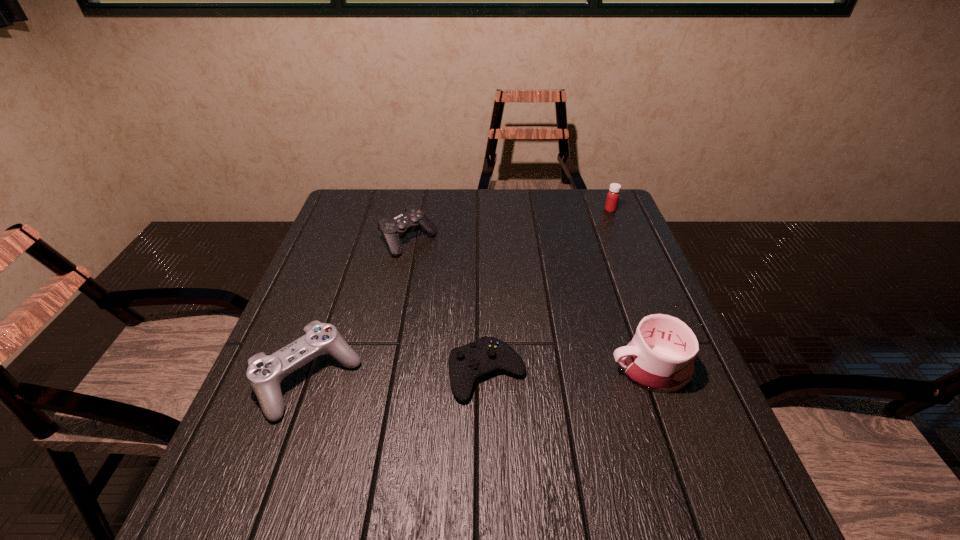
The height and width of the screenshot is (540, 960). Find the location of `object that is the fourth closest to the shortest control`. object that is the fourth closest to the shortest control is located at coordinates (x=613, y=195).

Identify the location of object that is the third closest to the second farthest object. The width and height of the screenshot is (960, 540). (660, 357).

Point out which control is positioned as the nearest to the farthest control. Please provide its 2D coordinates. Your answer should be formatted as a tuple, i.e. [(x, y)], where the tuple contains the x and y coordinates of a point satisfying the conditions above.

[(265, 373)]

Identify which control is located as the second nearest to the mug. Please provide its 2D coordinates. Your answer should be formatted as a tuple, i.e. [(x, y)], where the tuple contains the x and y coordinates of a point satisfying the conditions above.

[(413, 218)]

The height and width of the screenshot is (540, 960). I want to click on free spot that satisfies the following two spatial constraints: 1. on the front side of the farthest object; 2. on the side with the handle of the mug, so coord(675,369).

At what (x,y) coordinates should I click in order to perform the action: click on free point that satisfies the following two spatial constraints: 1. on the front side of the farthest control; 2. on the right side of the shortest object. Please return your answer as a coordinate pair (x, y). The image size is (960, 540). Looking at the image, I should click on (381, 373).